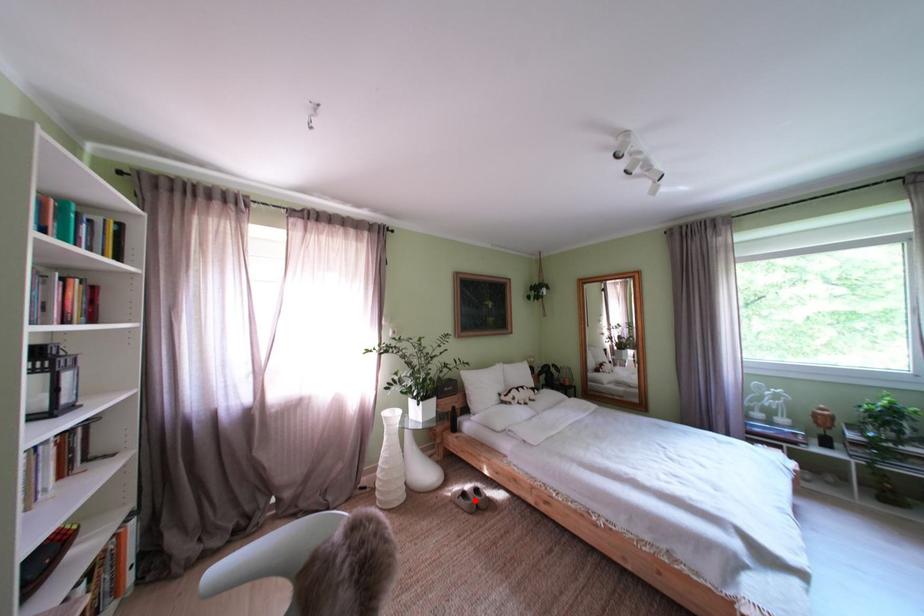
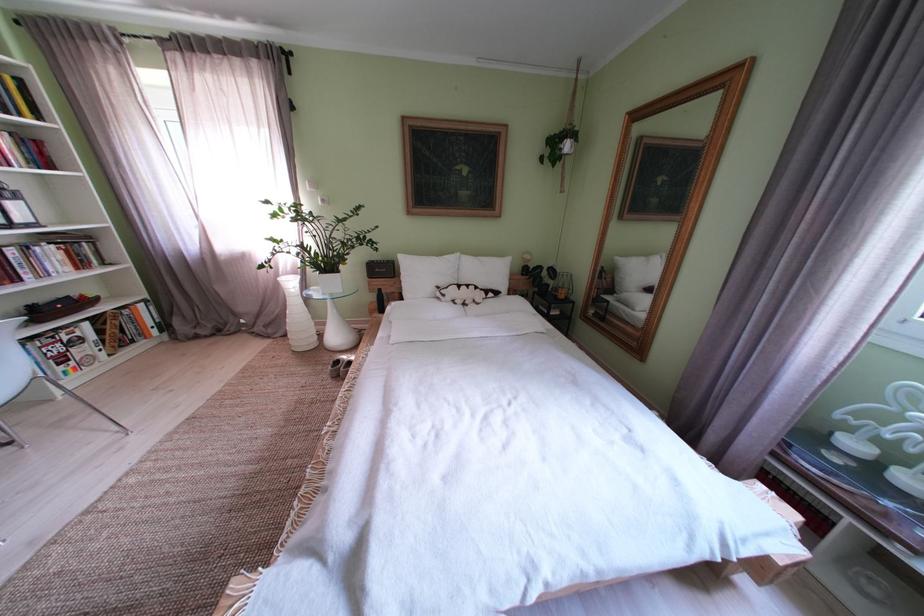
Question: I am providing you with two images of the same scene from different viewpoints. In image1, a red point is highlighted. Considering the same 3D point in image2, which of the following is correct?

Choices:
 (A) It is closer
 (B) It is farther

Answer: (B)